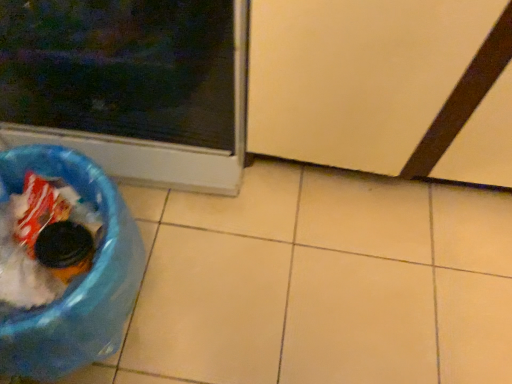
Question: Is transparent plastic screen door at lower right bigger or smaller than blue plastic recycling bin at lower left?

Choices:
 (A) small
 (B) big

Answer: (B)

Question: Is point (303, 29) positioned closer to the camera than point (3, 173)?

Choices:
 (A) farther
 (B) closer

Answer: (B)

Question: Which object is positioned farthest from the blue plastic recycling bin at lower left?

Choices:
 (A) transparent plastic screen door at lower right
 (B) matte plastic trash can at lower left

Answer: (A)

Question: Estimate the real-world distances between objects in this image. Which object is closer to the blue plastic recycling bin at lower left?

Choices:
 (A) transparent plastic screen door at lower right
 (B) matte plastic trash can at lower left

Answer: (B)